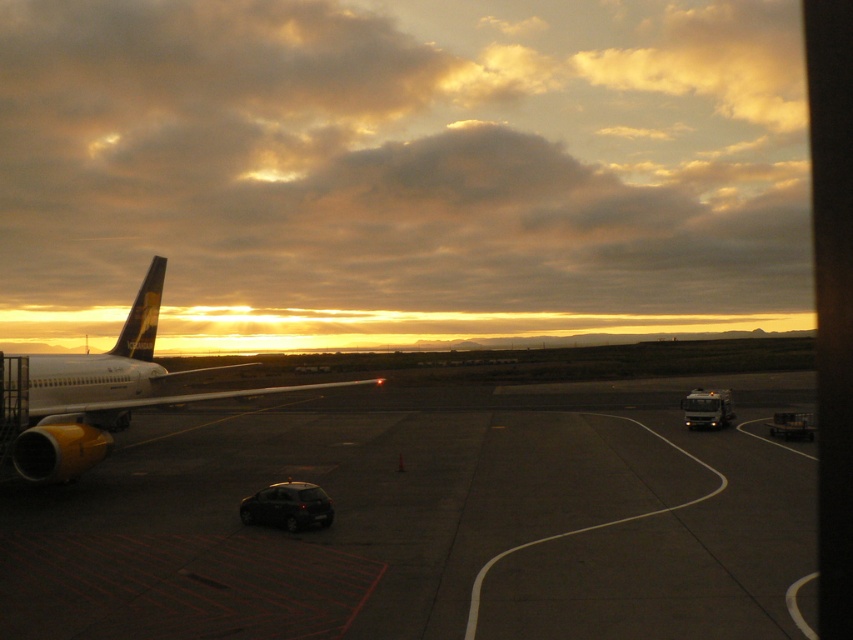
Question: Is smooth asphalt tarmac at center positioned before yellow matte airplane at left?

Choices:
 (A) yes
 (B) no

Answer: (A)

Question: Which object is farther from the camera taking this photo?

Choices:
 (A) yellow matte airplane at left
 (B) metallic silver cart at lower right
 (C) shiny black car at lower center

Answer: (B)

Question: Can you confirm if cloudy sky at upper center is positioned below yellow matte airplane at left?

Choices:
 (A) no
 (B) yes

Answer: (A)

Question: Which point is farther from the camera taking this photo?

Choices:
 (A) (804, 118)
 (B) (276, 516)
 (C) (74, 449)
 (D) (54, 497)

Answer: (A)

Question: Which point is farther to the camera?

Choices:
 (A) cloudy sky at upper center
 (B) metallic silver truck at right

Answer: (A)

Question: Can you confirm if yellow matte airplane at left is smaller than shiny black car at lower center?

Choices:
 (A) no
 (B) yes

Answer: (A)